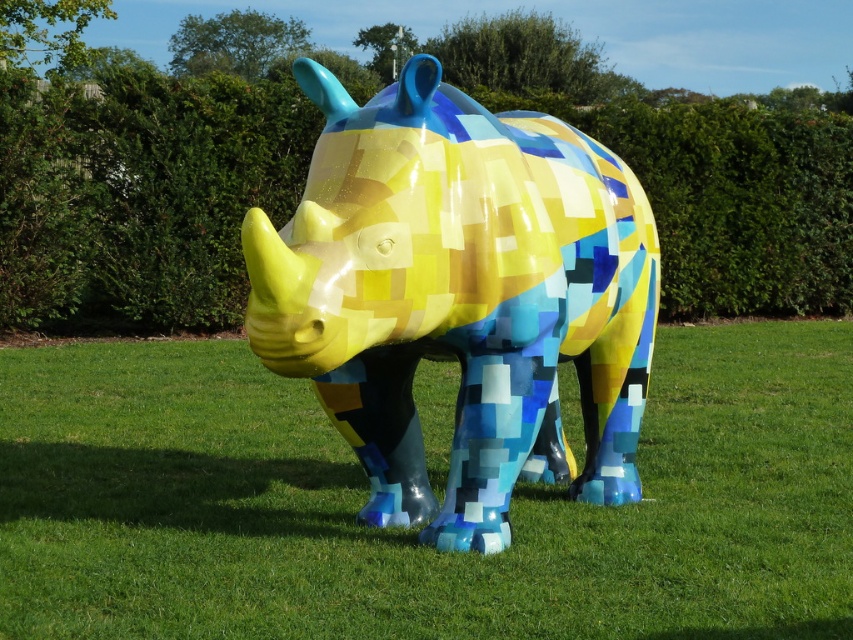
Question: Which object is closer to the camera taking this photo?

Choices:
 (A) green leafy hedge at center
 (B) pixelated plastic rhino at center
 (C) pixelated yellow rhino at center

Answer: (C)

Question: Which point appears farthest from the camera in this image?

Choices:
 (A) pyautogui.click(x=13, y=104)
 (B) pyautogui.click(x=276, y=492)

Answer: (A)

Question: Which point appears farthest from the camera in this image?

Choices:
 (A) (96, 240)
 (B) (796, 547)

Answer: (A)

Question: Is pixelated yellow rhino at center closer to camera compared to pixelated plastic rhino at center?

Choices:
 (A) yes
 (B) no

Answer: (A)

Question: Is pixelated yellow rhino at center to the left of green leafy hedge at center from the viewer's perspective?

Choices:
 (A) no
 (B) yes

Answer: (B)

Question: Does pixelated yellow rhino at center appear under green leafy hedge at center?

Choices:
 (A) no
 (B) yes

Answer: (B)